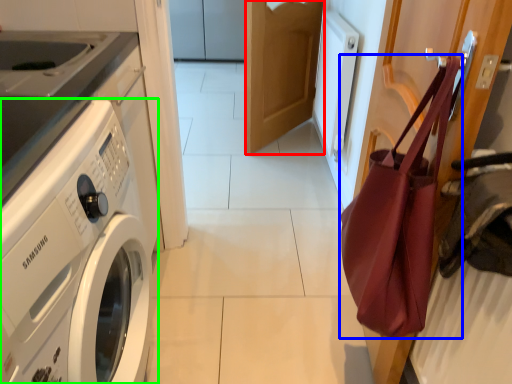
Question: Which is farther away from door (highlighted by a red box)? tote bag (highlighted by a blue box) or washing machine (highlighted by a green box)?

Choices:
 (A) tote bag
 (B) washing machine

Answer: (B)